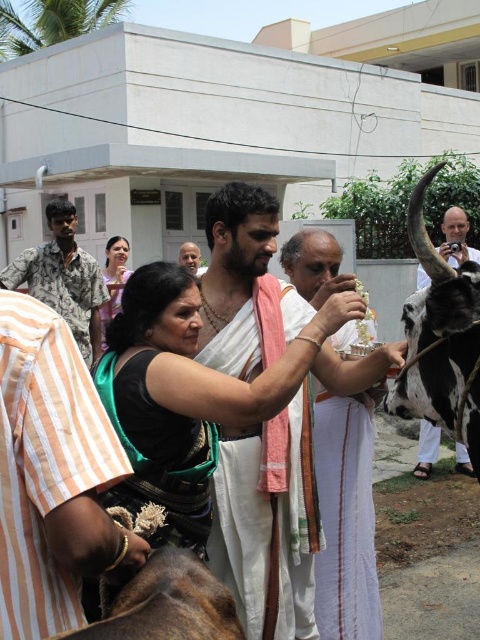
Question: Observing the image, what is the correct spatial positioning of black and white cow at right in reference to matte green saree at center?

Choices:
 (A) below
 (B) above

Answer: (A)

Question: Which object is closer to the camera taking this photo?

Choices:
 (A) white silk dhoti at center
 (B) white clothed man at center
 (C) camouflage-patterned shirt at left
 (D) smooth skin face at center

Answer: (B)

Question: Which point is farther from the camera taking this photo?

Choices:
 (A) [468, 221]
 (B) [116, 310]

Answer: (B)

Question: Can you confirm if white clothed man at center is positioned to the right of white silk dhoti at center?

Choices:
 (A) no
 (B) yes

Answer: (A)

Question: Can you confirm if white silk dhoti at center is positioned to the right of black and white cow at right?

Choices:
 (A) yes
 (B) no

Answer: (B)

Question: Which point appears closest to the camera in this image?

Choices:
 (A) (216, 502)
 (B) (107, 248)

Answer: (A)